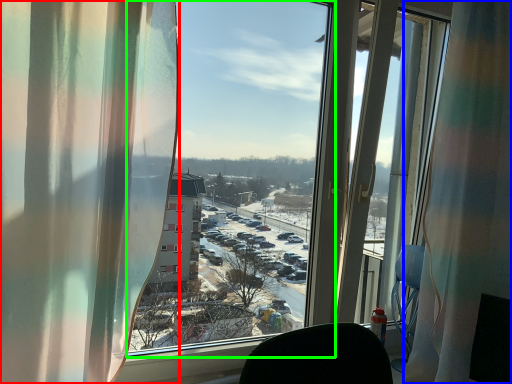
Question: Which is farther away from curtain (highlighted by a red box)? curtain (highlighted by a blue box) or window screen (highlighted by a green box)?

Choices:
 (A) curtain
 (B) window screen

Answer: (B)